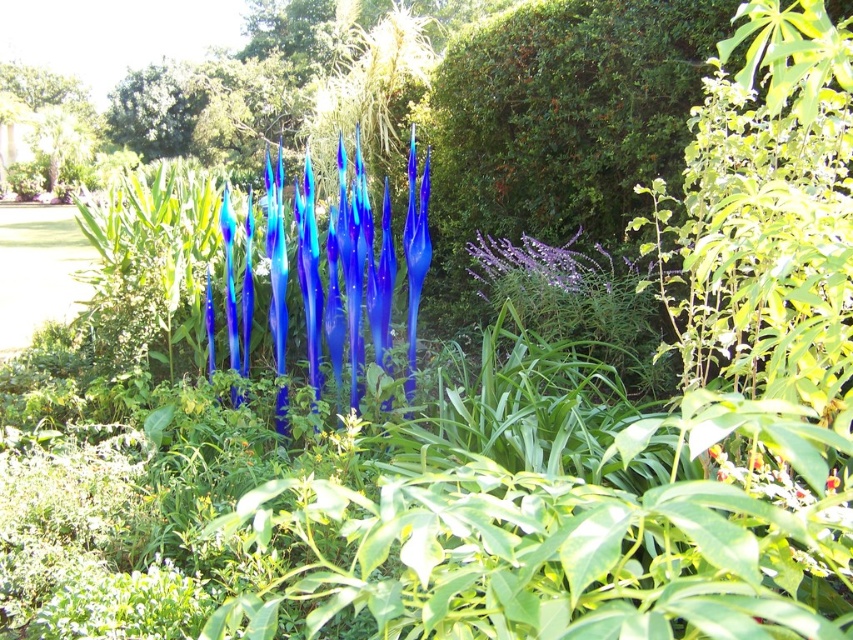
Does glossy glass spikes at center appear under purple matte flower at center-right?

No, glossy glass spikes at center is not below purple matte flower at center-right.

Looking at this image, which of these two, glossy glass spikes at center or purple matte flower at center-right, stands taller?

With more height is glossy glass spikes at center.

Which is in front, point (352, 276) or point (483, 264)?

Positioned in front is point (352, 276).

Identify the location of glossy glass spikes at center. (344, 275).